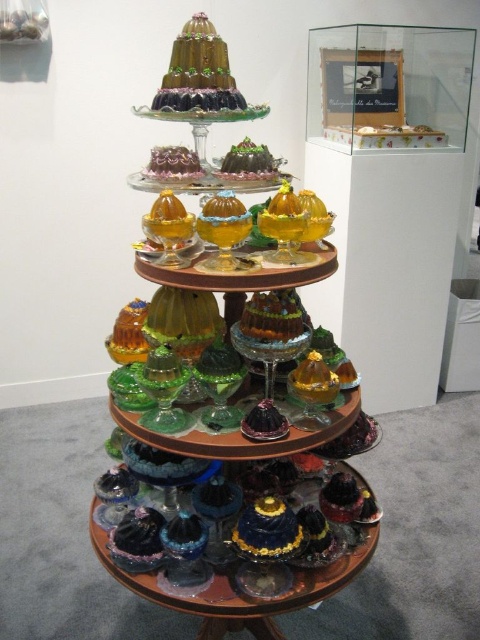
Question: Estimate the real-world distances between objects in this image. Which object is farther from the transparent glass wine glass at center?

Choices:
 (A) shiny gold cake at center
 (B) shiny dark blue cake at center

Answer: (B)

Question: Which of these objects is positioned farthest from the shiny gold cake at center?

Choices:
 (A) chocolate frosted cake at upper center
 (B) shiny dark blue glass at center

Answer: (B)

Question: Does shiny gold cake at center have a smaller size compared to shiny chocolate cake at center?

Choices:
 (A) yes
 (B) no

Answer: (B)

Question: Does translucent amber glass wine glass at center appear over shiny dark blue cake at center?

Choices:
 (A) yes
 (B) no

Answer: (A)

Question: Which of the following is the farthest from the observer?

Choices:
 (A) transparent glass wine glass at center
 (B) green glass wine glass at center
 (C) shiny chocolate cake at center

Answer: (C)

Question: In this image, where is shiny dark blue glass at center located relative to green glossy cake at center?

Choices:
 (A) below
 (B) above

Answer: (A)